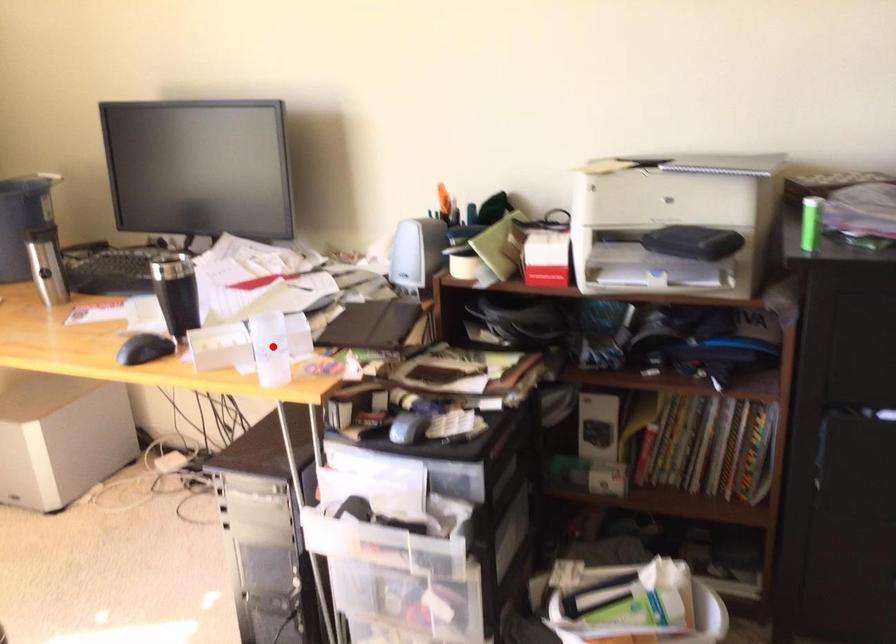
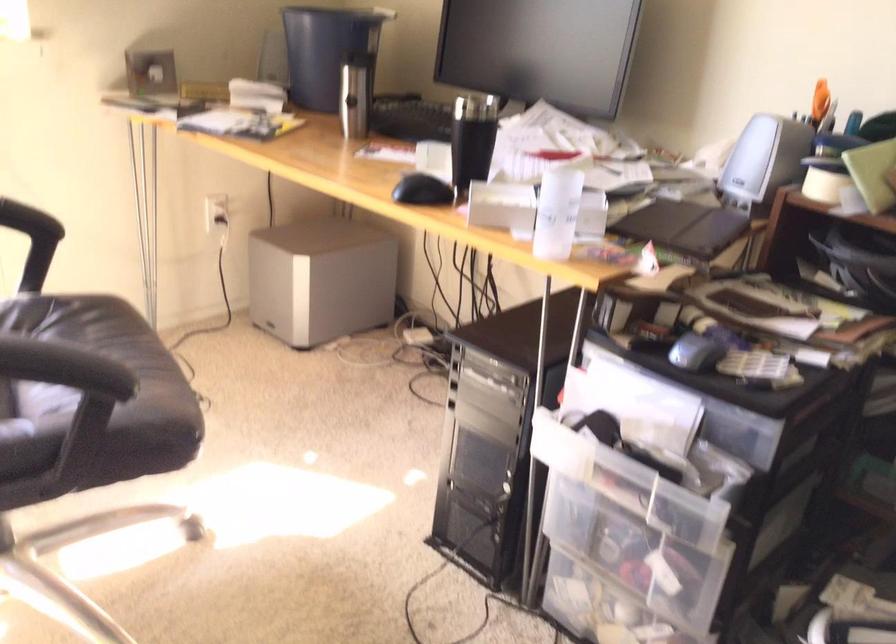
Find the pixel in the second image that matches the highlighted location in the first image.

(556, 213)